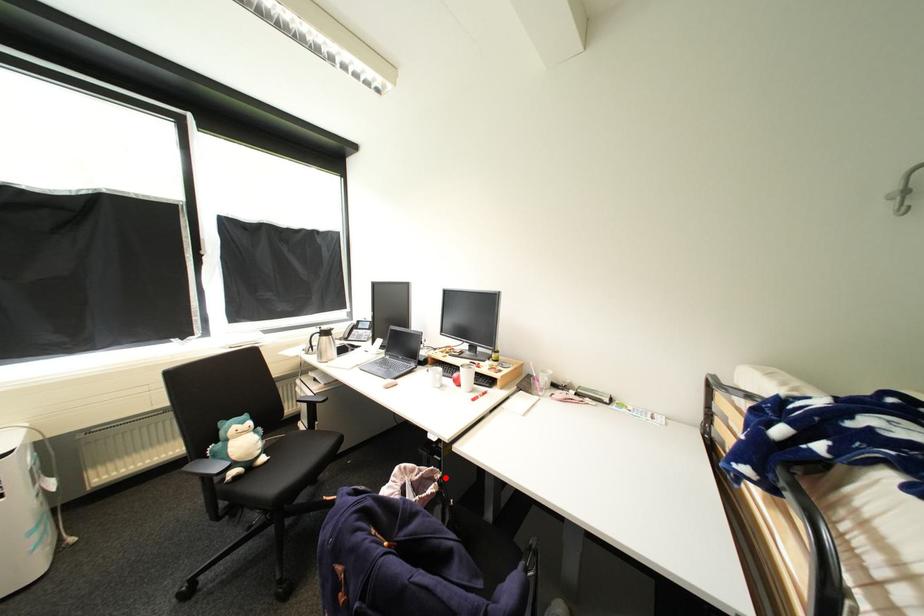
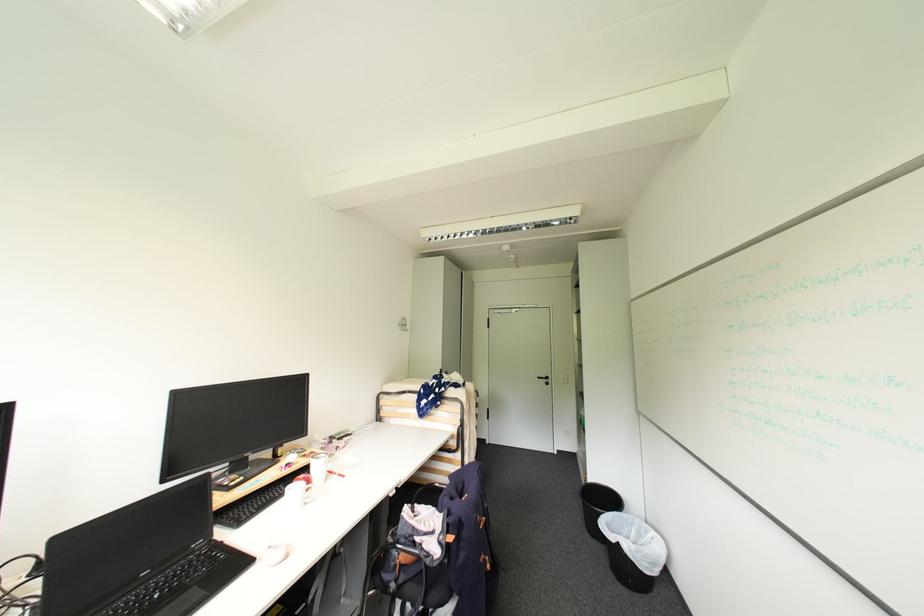
In the second image, find the point that corresponds to the highlighted location in the first image.

(417, 506)